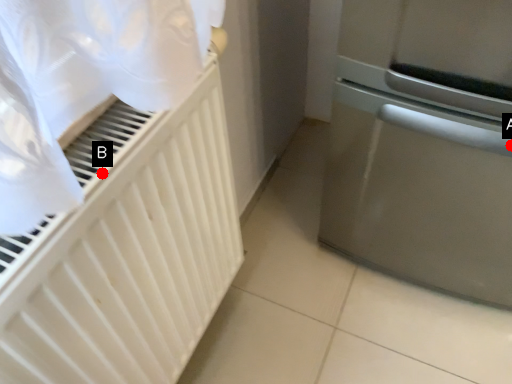
Question: Two points are circled on the image, labeled by A and B beside each circle. Which point is further to the camera?

Choices:
 (A) A is further
 (B) B is further

Answer: (A)